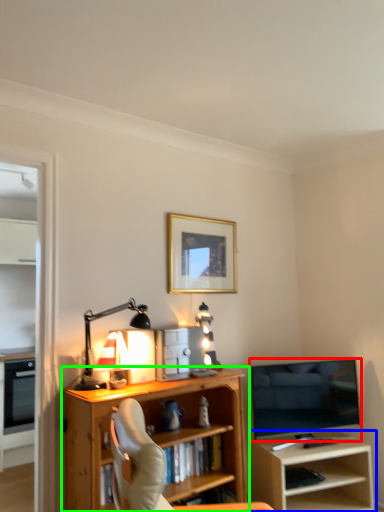
Question: Which object is the closest to the television (highlighted by a red box)? Choose among these: shelf (highlighted by a blue box) or bookcase (highlighted by a green box).

Choices:
 (A) shelf
 (B) bookcase

Answer: (A)